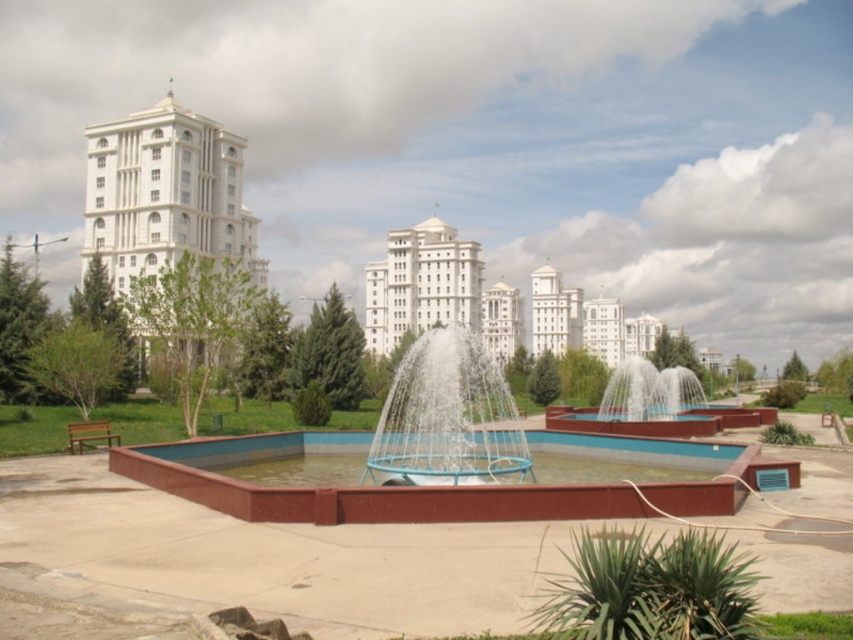
You are standing at the fountain in the park and want to take a photo of the white glossy building at center. Based on your position, where should you aim your camera to capture the building in the frame?

The white glossy building at center is located at coordinates 0.456 on the x axis and 0.513 on the y axis, so you should aim your camera towards the center of the park to capture it in the frame.

You are a drone operator who needs to capture a photo of the blue concrete fountain at center and the white glossy building at center. From your current position above the park, which object should you point the camera towards first to ensure both are in frame?

The blue concrete fountain at center is below the white glossy building at center, so you should point the camera towards the white glossy building at center first to ensure both are visible in the frame.

You are standing in the urban park and want to take a photo of the white glossy building at upper left and the white glossy building at center. Which building will appear closer to the camera in the photo?

The white glossy building at upper left will appear closer to the camera in the photo because it is positioned in front of the white glossy building at center.